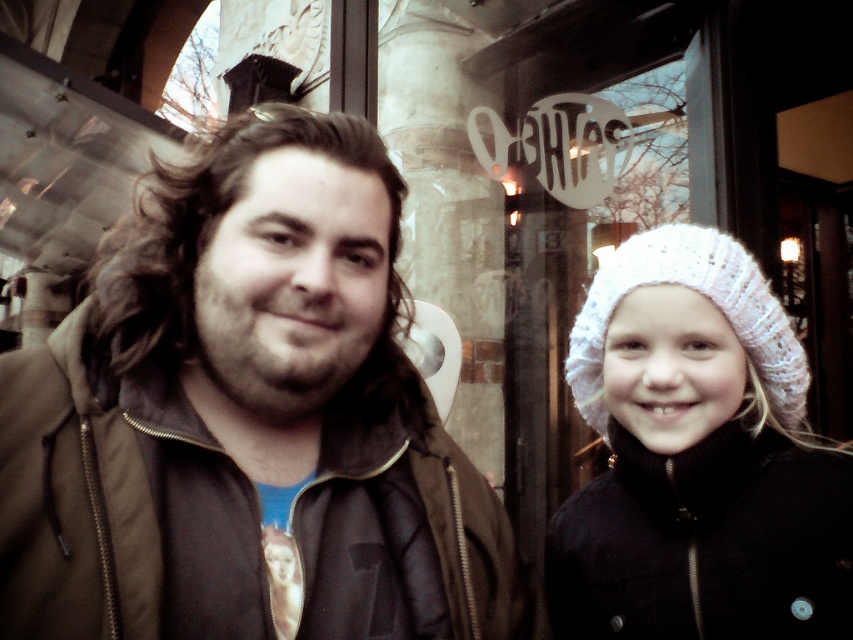
You are a fashion designer who wants to place a new accessory exactly at the center of the image. However, you must avoid overlapping with the brown matte jacket at center. Based on the coordinates provided, where should you place the accessory instead?

The brown matte jacket at center is located at coordinates point (247, 420). To avoid overlapping, place the accessory at the true center of the image, which is at point (426, 320).